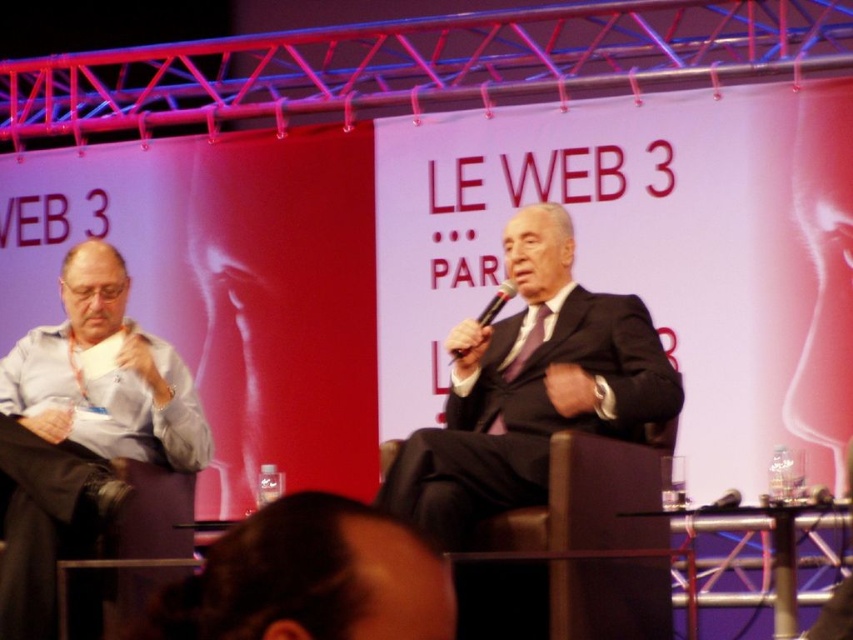
Can you confirm if matte black suit at center is positioned below blue shirt at left?

Actually, matte black suit at center is above blue shirt at left.

Is matte black suit at center positioned at the back of blue shirt at left?

No, it is not.

The image size is (853, 640). What do you see at coordinates (529, 388) in the screenshot? I see `matte black suit at center` at bounding box center [529, 388].

Where is `matte black suit at center`? matte black suit at center is located at coordinates (529, 388).

Is blue shirt at left to the right of black plastic microphone at center from the viewer's perspective?

No, blue shirt at left is not to the right of black plastic microphone at center.

Is blue shirt at left wider than black plastic microphone at center?

Yes.

Between point (38, 378) and point (463, 355), which one is positioned in front?

Positioned in front is point (463, 355).

You are a GUI agent. You are given a task and a screenshot of the screen. Output one action in this format:
    pyautogui.click(x=<x>, y=<y>)
    Task: Click on the blue shirt at left
    The height and width of the screenshot is (640, 853).
    Given the screenshot: What is the action you would take?
    pyautogui.click(x=80, y=433)

Is point (567, 275) closer to camera compared to point (498, 294)?

No, (567, 275) is behind (498, 294).

Consider the image. Does matte black suit at center have a greater width compared to black plastic microphone at center?

Indeed, matte black suit at center has a greater width compared to black plastic microphone at center.

Locate an element on the screen. matte black suit at center is located at coordinates (529, 388).